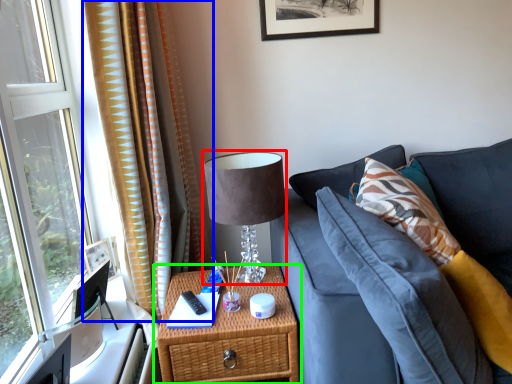
Question: Which is nearer to the table lamp (highlighted by a red box)? curtain (highlighted by a blue box) or nightstand (highlighted by a green box).

Choices:
 (A) curtain
 (B) nightstand

Answer: (B)